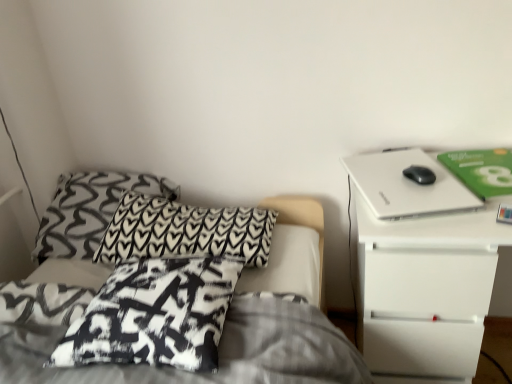
Question: Is white matte laptop at upper right facing away from black printed pillow at center, which appears as the 3th pillow when viewed from the back?

Choices:
 (A) no
 (B) yes

Answer: (A)

Question: Does white matte laptop at upper right lie behind black printed pillow at center, arranged as the 1th pillow when viewed from the front?

Choices:
 (A) yes
 (B) no

Answer: (A)

Question: Is white matte laptop at upper right closer to the viewer compared to black printed pillow at center, which appears as the 3th pillow when viewed from the back?

Choices:
 (A) yes
 (B) no

Answer: (B)

Question: From a real-world perspective, is white matte laptop at upper right over black printed pillow at center, arranged as the 1th pillow when viewed from the front?

Choices:
 (A) yes
 (B) no

Answer: (A)

Question: From a real-world perspective, is white matte laptop at upper right physically below black printed pillow at center, which appears as the 3th pillow when viewed from the back?

Choices:
 (A) yes
 (B) no

Answer: (B)

Question: From a real-world perspective, is white matte nightstand at right positioned above or below white matte laptop at upper right?

Choices:
 (A) above
 (B) below

Answer: (B)

Question: Does point (444, 327) appear closer or farther from the camera than point (458, 180)?

Choices:
 (A) closer
 (B) farther

Answer: (A)

Question: In terms of width, does white matte nightstand at right look wider or thinner when compared to white matte laptop at upper right?

Choices:
 (A) thin
 (B) wide

Answer: (B)

Question: In the image, is white matte nightstand at right on the left side or the right side of white matte laptop at upper right?

Choices:
 (A) left
 (B) right

Answer: (B)

Question: From the image's perspective, is white matte nightstand at right positioned above or below black printed fabric pillow at upper left, acting as the 2th pillow starting from the front?

Choices:
 (A) above
 (B) below

Answer: (B)

Question: Considering their positions, is white matte nightstand at right located in front of or behind black printed fabric pillow at upper left, acting as the 2th pillow starting from the front?

Choices:
 (A) front
 (B) behind

Answer: (A)

Question: Choose the correct answer: Is white matte nightstand at right inside black printed fabric pillow at upper left, acting as the 2th pillow starting from the front, or outside it?

Choices:
 (A) inside
 (B) outside

Answer: (B)

Question: Is point (490, 218) positioned closer to the camera than point (124, 193)?

Choices:
 (A) closer
 (B) farther

Answer: (A)

Question: Based on their positions, is black printed pillow at center, arranged as the 1th pillow when viewed from the front, located to the left or right of black printed fabric pillow at upper left, acting as the 2th pillow starting from the front?

Choices:
 (A) left
 (B) right

Answer: (A)

Question: Considering their positions, is black printed pillow at center, arranged as the 1th pillow when viewed from the front, located in front of or behind black printed fabric pillow at upper left, acting as the 2th pillow starting from the front?

Choices:
 (A) front
 (B) behind

Answer: (A)